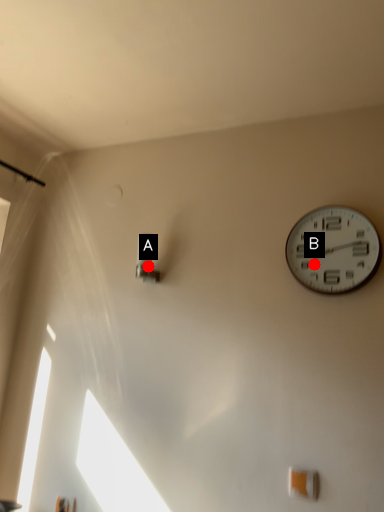
Question: Two points are circled on the image, labeled by A and B beside each circle. Which of the following is the closest to the observer?

Choices:
 (A) A is closer
 (B) B is closer

Answer: (B)